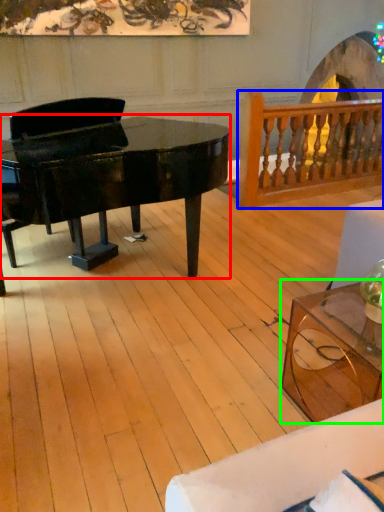
Question: Considering the real-world distances, which object is closest to piano (highlighted by a red box)? rail (highlighted by a blue box) or coffee table (highlighted by a green box).

Choices:
 (A) rail
 (B) coffee table

Answer: (B)